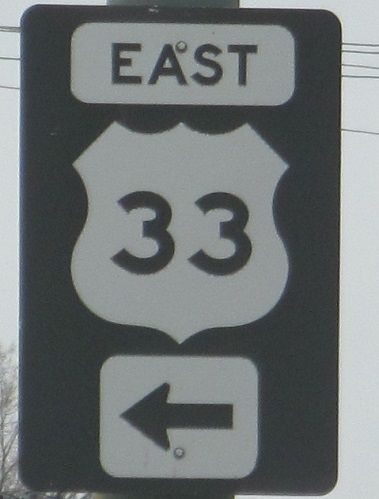
The height and width of the screenshot is (499, 379). Find the location of `screws`. screws is located at coordinates (182, 46), (177, 452).